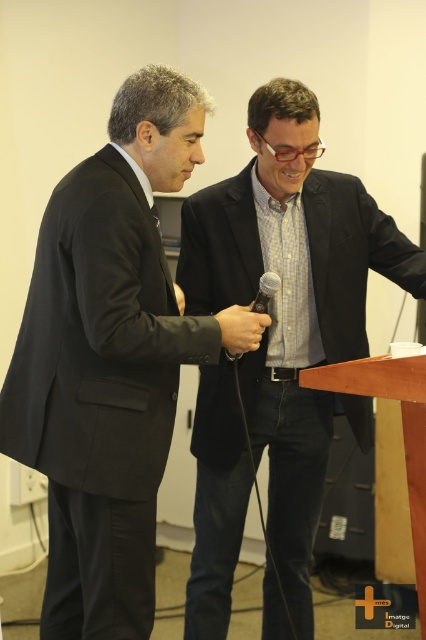
You are a photographer positioned behind the matte black microphone at center. You want to capture a photo of the matte black suit at left. Which direction should you move to get a better shot?

Since the matte black suit at left is below the matte black microphone at center, you should move downward to capture a better shot of the matte black suit at left.

You are a photographer trying to focus on two points in the image, point 1 at coordinates point (69,445) and point 2 at coordinates point (359,308). Which point should you adjust your focus to first if you want to capture both points clearly in the photo?

Point (69,445) is closer to the camera than point (359,308), so you should focus on point (69,445) first to ensure both points are in focus.